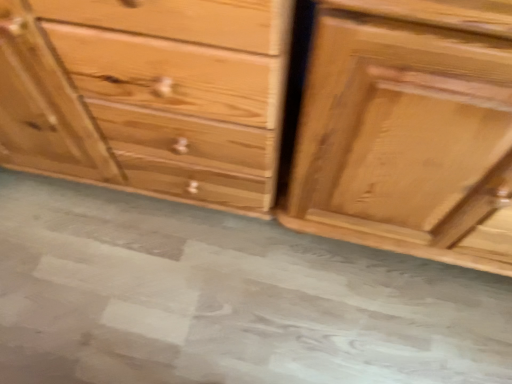
Question: From the image's perspective, is shiny brown wood drawer at right, the 1th chest of drawers viewed from the right, under natural wood chest of drawers at center, which is counted as the second chest of drawers, starting from the right?

Choices:
 (A) no
 (B) yes

Answer: (B)

Question: Is natural wood chest of drawers at center, which is counted as the second chest of drawers, starting from the right, a part of shiny brown wood drawer at right, the 1th chest of drawers viewed from the right?

Choices:
 (A) yes
 (B) no

Answer: (B)

Question: Does shiny brown wood drawer at right, which is the 2th chest of drawers from left to right, have a larger size compared to natural wood chest of drawers at center, which is the first chest of drawers in left-to-right order?

Choices:
 (A) no
 (B) yes

Answer: (A)

Question: Considering the relative positions of shiny brown wood drawer at right, the 1th chest of drawers viewed from the right, and natural wood chest of drawers at center, which is counted as the second chest of drawers, starting from the right, in the image provided, is shiny brown wood drawer at right, the 1th chest of drawers viewed from the right, to the left of natural wood chest of drawers at center, which is counted as the second chest of drawers, starting from the right, from the viewer's perspective?

Choices:
 (A) no
 (B) yes

Answer: (A)

Question: Can you confirm if shiny brown wood drawer at right, which is the 2th chest of drawers from left to right, is thinner than natural wood chest of drawers at center, which is the first chest of drawers in left-to-right order?

Choices:
 (A) no
 (B) yes

Answer: (B)

Question: Could you tell me if shiny brown wood drawer at right, the 1th chest of drawers viewed from the right, is facing natural wood chest of drawers at center, which is the first chest of drawers in left-to-right order?

Choices:
 (A) no
 (B) yes

Answer: (A)

Question: Is shiny brown wood drawer at right, the 1th chest of drawers viewed from the right, oriented towards gray concrete at center?

Choices:
 (A) yes
 (B) no

Answer: (B)

Question: Is gray concrete at center at the back of shiny brown wood drawer at right, which is the 2th chest of drawers from left to right?

Choices:
 (A) yes
 (B) no

Answer: (B)

Question: Does shiny brown wood drawer at right, the 1th chest of drawers viewed from the right, have a greater height compared to gray concrete at center?

Choices:
 (A) no
 (B) yes

Answer: (B)

Question: Is shiny brown wood drawer at right, the 1th chest of drawers viewed from the right, wider than gray concrete at center?

Choices:
 (A) no
 (B) yes

Answer: (A)

Question: Is shiny brown wood drawer at right, the 1th chest of drawers viewed from the right, directly adjacent to gray concrete at center?

Choices:
 (A) yes
 (B) no

Answer: (B)

Question: Considering the relative sizes of shiny brown wood drawer at right, the 1th chest of drawers viewed from the right, and gray concrete at center in the image provided, is shiny brown wood drawer at right, the 1th chest of drawers viewed from the right, bigger than gray concrete at center?

Choices:
 (A) no
 (B) yes

Answer: (B)

Question: Is natural wood chest of drawers at center, which is the first chest of drawers in left-to-right order, at the left side of shiny brown wood drawer at right, which is the 2th chest of drawers from left to right?

Choices:
 (A) no
 (B) yes

Answer: (B)